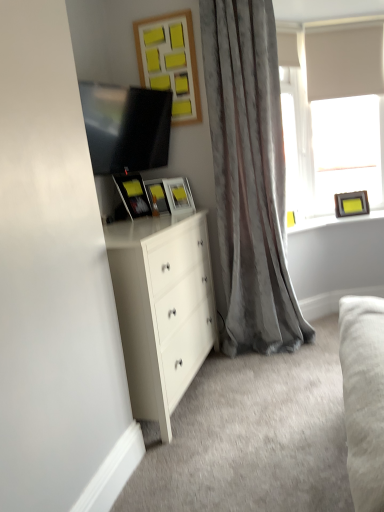
The width and height of the screenshot is (384, 512). Describe the element at coordinates (133, 195) in the screenshot. I see `matte black picture frame at center, placed as the fifth picture frame when sorted from right to left` at that location.

Describe the element at coordinates (332, 221) in the screenshot. I see `yellow matte frame at upper right` at that location.

Consider the image. What is the approximate height of wooden yellow sticky notes at upper center, acting as the 3th picture frame starting from the right?

wooden yellow sticky notes at upper center, acting as the 3th picture frame starting from the right, is 67.23 centimeters tall.

You are a GUI agent. You are given a task and a screenshot of the screen. Output one action in this format:
    pyautogui.click(x=<x>, y=<y>)
    Task: Click on the matte black tv at upper left
    The height and width of the screenshot is (512, 384).
    Given the screenshot: What is the action you would take?
    pyautogui.click(x=126, y=127)

Locate an element on the screen. matte yellow picture frame at upper center, which ranks as the second picture frame in right-to-left order is located at coordinates (178, 196).

Describe the element at coordinates (162, 308) in the screenshot. The height and width of the screenshot is (512, 384). I see `white glossy chest of drawers at left` at that location.

What do you see at coordinates (351, 204) in the screenshot?
I see `matte black picture frame at upper right, positioned as the fifth picture frame in left-to-right order` at bounding box center [351, 204].

This screenshot has width=384, height=512. Identify the location of white matte window at upper right. (332, 114).

From the image's perspective, is white glossy chest of drawers at left positioned above or below matte white picture frame at center, arranged as the 4th picture frame when viewed from the right?

Based on their image positions, white glossy chest of drawers at left is located beneath matte white picture frame at center, arranged as the 4th picture frame when viewed from the right.

Which object is positioned more to the right, white glossy chest of drawers at left or matte white picture frame at center, arranged as the 4th picture frame when viewed from the right?

matte white picture frame at center, arranged as the 4th picture frame when viewed from the right, is more to the right.

From a real-world perspective, is white glossy chest of drawers at left over matte white picture frame at center, arranged as the 4th picture frame when viewed from the right?

No, from a real-world perspective, white glossy chest of drawers at left is not over matte white picture frame at center, arranged as the 4th picture frame when viewed from the right

Considering the sizes of white glossy chest of drawers at left and matte white picture frame at center, arranged as the 4th picture frame when viewed from the right, in the image, is white glossy chest of drawers at left bigger or smaller than matte white picture frame at center, arranged as the 4th picture frame when viewed from the right,?

Considering their sizes, white glossy chest of drawers at left takes up more space than matte white picture frame at center, arranged as the 4th picture frame when viewed from the right.

Which object is wider, matte black tv at upper left or wooden yellow sticky notes at upper center, acting as the 3th picture frame starting from the right?

Wider between the two is matte black tv at upper left.

Considering the points (106, 140) and (146, 73), which point is in front, point (106, 140) or point (146, 73)?

The point (106, 140) is in front.

Which is behind, matte black tv at upper left or wooden yellow sticky notes at upper center, which is counted as the third picture frame, starting from the left?

wooden yellow sticky notes at upper center, which is counted as the third picture frame, starting from the left, is further from the camera.

Is matte black tv at upper left in contact with wooden yellow sticky notes at upper center, which is counted as the third picture frame, starting from the left?

matte black tv at upper left and wooden yellow sticky notes at upper center, which is counted as the third picture frame, starting from the left, are clearly separated.

Which is in front, satin gray curtain at center or matte black picture frame at center, which appears as the 1th picture frame when viewed from the left?

satin gray curtain at center.

Between satin gray curtain at center and matte black picture frame at center, which appears as the 1th picture frame when viewed from the left, which one has larger width?

satin gray curtain at center is wider.

Is satin gray curtain at center inside the boundaries of matte black picture frame at center, placed as the fifth picture frame when sorted from right to left, or outside?

satin gray curtain at center is not enclosed by matte black picture frame at center, placed as the fifth picture frame when sorted from right to left.

Does point (351, 486) come in front of point (140, 191)?

Yes, point (351, 486) is in front of point (140, 191).

How much distance is there between white soft fabric couch at lower right and matte black picture frame at center, which appears as the 1th picture frame when viewed from the left?

white soft fabric couch at lower right is 1.52 meters from matte black picture frame at center, which appears as the 1th picture frame when viewed from the left.

Identify the location of studio couch below the matte black picture frame at center, placed as the fifth picture frame when sorted from right to left (from the image's perspective). (363, 397).

Considering the positions of objects matte black tv at upper left and white soft fabric couch at lower right in the image provided, who is in front, matte black tv at upper left or white soft fabric couch at lower right?

white soft fabric couch at lower right.

What's the angular difference between matte black tv at upper left and white soft fabric couch at lower right's facing directions?

165 degrees.

Find the location of `television located on the left of white soft fabric couch at lower right`. television located on the left of white soft fabric couch at lower right is located at coordinates (126, 127).

Are matte black tv at upper left and white soft fabric couch at lower right far apart?

Yes, matte black tv at upper left and white soft fabric couch at lower right are located far from each other.

From a real-world perspective, between satin gray curtain at center and yellow matte frame at upper right, who is vertically lower?

In real-world perspective, yellow matte frame at upper right is lower.

Which is in front, point (207, 90) or point (302, 225)?

The point (207, 90) is closer to the camera.

Could you tell me if satin gray curtain at center is facing yellow matte frame at upper right?

No, satin gray curtain at center is not oriented towards yellow matte frame at upper right.

Would you say satin gray curtain at center is inside or outside yellow matte frame at upper right?

satin gray curtain at center cannot be found inside yellow matte frame at upper right.

Is satin gray curtain at center a part of matte white picture frame at center, marked as the 2th picture frame in a left-to-right arrangement?

That's incorrect, satin gray curtain at center is not inside matte white picture frame at center, marked as the 2th picture frame in a left-to-right arrangement.

In order to click on curtain that is in front of the matte white picture frame at center, arranged as the 4th picture frame when viewed from the right in this screenshot , I will do `click(249, 176)`.

Between matte white picture frame at center, marked as the 2th picture frame in a left-to-right arrangement, and satin gray curtain at center, which one is positioned behind?

matte white picture frame at center, marked as the 2th picture frame in a left-to-right arrangement, is further away from the camera.

Does point (159, 189) appear closer or farther from the camera than point (272, 244)?

Point (159, 189).

Locate an element on the screen. the 3rd picture frame behind when counting from the white glossy chest of drawers at left is located at coordinates (157, 195).

Locate an element on the screen. The width and height of the screenshot is (384, 512). picture frame above the matte black tv at upper left (from a real-world perspective) is located at coordinates (170, 62).

Based on their spatial positions, is white matte window at upper right or matte black picture frame at center, placed as the fifth picture frame when sorted from right to left, closer to wooden yellow sticky notes at upper center, which is counted as the third picture frame, starting from the left?

matte black picture frame at center, placed as the fifth picture frame when sorted from right to left, is positioned closer to the anchor wooden yellow sticky notes at upper center, which is counted as the third picture frame, starting from the left.

Estimate the real-world distances between objects in this image. Which object is closer to satin gray curtain at center, matte yellow picture frame at upper center, arranged as the 4th picture frame when viewed from the left, or wooden yellow sticky notes at upper center, which is counted as the third picture frame, starting from the left?

wooden yellow sticky notes at upper center, which is counted as the third picture frame, starting from the left, is positioned closer to the anchor satin gray curtain at center.

Looking at the image, which one is located closer to wooden yellow sticky notes at upper center, acting as the 3th picture frame starting from the right, matte black picture frame at upper right, positioned as the fifth picture frame in left-to-right order, or matte black tv at upper left?

matte black tv at upper left lies closer to wooden yellow sticky notes at upper center, acting as the 3th picture frame starting from the right, than the other object.

Looking at the image, which one is located closer to white matte window at upper right, satin gray curtain at center or matte black picture frame at center, placed as the fifth picture frame when sorted from right to left?

The object closer to white matte window at upper right is satin gray curtain at center.

When comparing their distances from matte black tv at upper left, does yellow matte frame at upper right or white matte window at upper right seem closer?

white matte window at upper right is closer to matte black tv at upper left.

Estimate the real-world distances between objects in this image. Which object is further from white matte window at upper right, matte yellow picture frame at upper center, arranged as the 4th picture frame when viewed from the left, or matte black tv at upper left?

matte black tv at upper left is further to white matte window at upper right.

Which object lies nearer to the anchor point white matte window at upper right, satin gray curtain at center or white glossy chest of drawers at left?

satin gray curtain at center is closer to white matte window at upper right.

From the image, which object appears to be farther from matte black tv at upper left, white soft fabric couch at lower right or matte yellow picture frame at upper center, which ranks as the second picture frame in right-to-left order?

white soft fabric couch at lower right is positioned further to the anchor matte black tv at upper left.

You are a GUI agent. You are given a task and a screenshot of the screen. Output one action in this format:
    pyautogui.click(x=<x>, y=<y>)
    Task: Click on the curtain situated between matte yellow picture frame at upper center, arranged as the 4th picture frame when viewed from the left, and matte black picture frame at upper right, the 1th picture frame from the right, from left to right
    This screenshot has height=512, width=384.
    Given the screenshot: What is the action you would take?
    pyautogui.click(x=249, y=176)

Locate an element on the screen. The width and height of the screenshot is (384, 512). the chest of drawers located between white soft fabric couch at lower right and wooden yellow sticky notes at upper center, which is counted as the third picture frame, starting from the left, in the depth direction is located at coordinates (162, 308).

Where is `curtain positioned between white glossy chest of drawers at left and matte black picture frame at upper right, positioned as the fifth picture frame in left-to-right order, from near to far`? The width and height of the screenshot is (384, 512). curtain positioned between white glossy chest of drawers at left and matte black picture frame at upper right, positioned as the fifth picture frame in left-to-right order, from near to far is located at coordinates (249, 176).

The image size is (384, 512). Find the location of `window located between matte white picture frame at center, marked as the 2th picture frame in a left-to-right arrangement, and matte black picture frame at upper right, positioned as the fifth picture frame in left-to-right order, in the left-right direction`. window located between matte white picture frame at center, marked as the 2th picture frame in a left-to-right arrangement, and matte black picture frame at upper right, positioned as the fifth picture frame in left-to-right order, in the left-right direction is located at coordinates (332, 114).